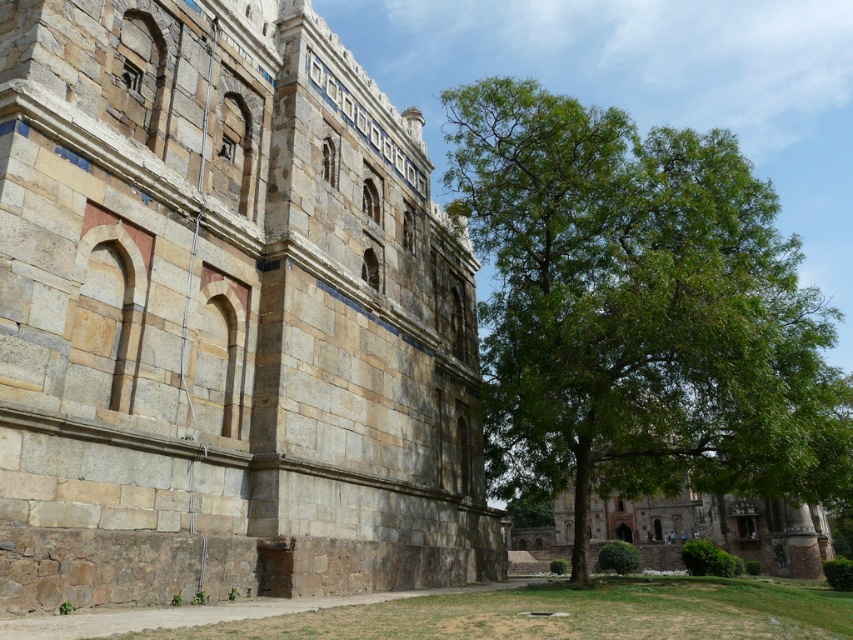
Question: Is stone wall at center closer to camera compared to green leafy tree at right?

Choices:
 (A) yes
 (B) no

Answer: (A)

Question: Which point appears closest to the camera in this image?

Choices:
 (A) (440, 317)
 (B) (578, 474)

Answer: (B)

Question: Among these objects, which one is nearest to the camera?

Choices:
 (A) stone wall at center
 (B) green leafy tree at right

Answer: (A)

Question: Which point is farther from the camera taking this photo?

Choices:
 (A) (86, 538)
 (B) (523, 218)

Answer: (B)

Question: Is stone wall at center thinner than green leafy tree at right?

Choices:
 (A) yes
 (B) no

Answer: (A)

Question: Can you confirm if stone wall at center is wider than green leafy tree at right?

Choices:
 (A) yes
 (B) no

Answer: (B)